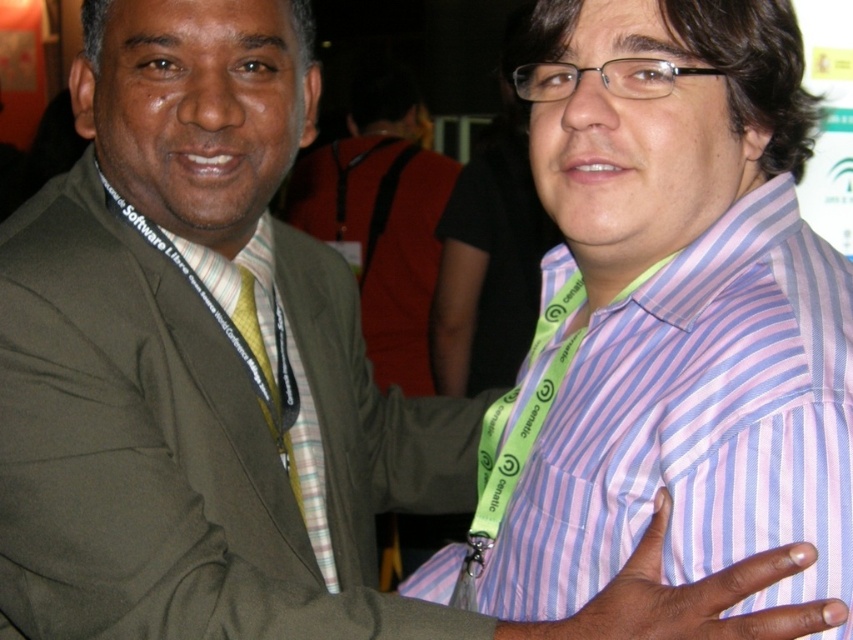
Question: Is the position of green fabric suit at left less distant than that of pink striped dress shirt at right?

Choices:
 (A) no
 (B) yes

Answer: (A)

Question: Considering the relative positions of green fabric suit at left and pink striped dress shirt at right in the image provided, where is green fabric suit at left located with respect to pink striped dress shirt at right?

Choices:
 (A) right
 (B) left

Answer: (B)

Question: Which object appears closest to the camera in this image?

Choices:
 (A) green fabric suit at left
 (B) pink striped dress shirt at right

Answer: (B)

Question: Considering the relative positions of green fabric suit at left and pink striped dress shirt at right in the image provided, where is green fabric suit at left located with respect to pink striped dress shirt at right?

Choices:
 (A) left
 (B) right

Answer: (A)

Question: Which point appears closest to the camera in this image?

Choices:
 (A) (73, 294)
 (B) (663, 412)

Answer: (B)